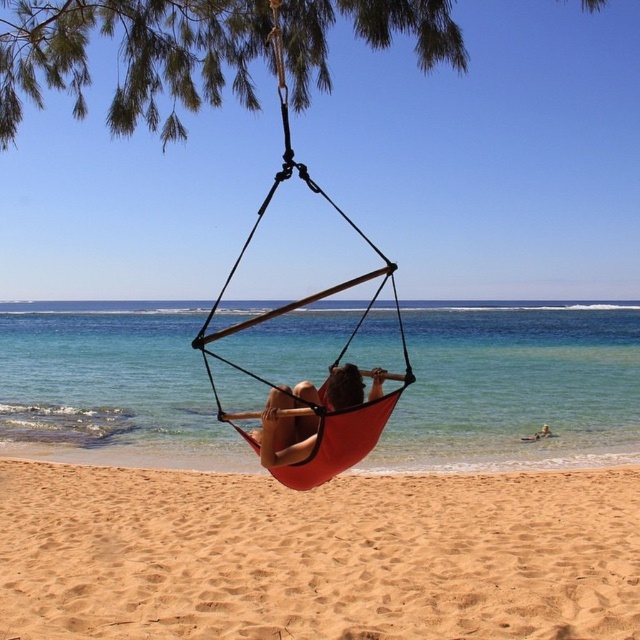
Is green leafy tree at upper center to the left of orange fabric hammock at center from the viewer's perspective?

Yes, green leafy tree at upper center is to the left of orange fabric hammock at center.

Who is more forward, (x=211, y=99) or (x=285, y=122)?

Point (x=285, y=122)

Where is `green leafy tree at upper center`? green leafy tree at upper center is located at coordinates (131, 58).

Does sandy yellow at lower center have a greater height compared to green leafy tree at upper center?

No, sandy yellow at lower center is not taller than green leafy tree at upper center.

From the picture: Who is lower down, sandy yellow at lower center or green leafy tree at upper center?

sandy yellow at lower center

The image size is (640, 640). Identify the location of sandy yellow at lower center. (317, 554).

Is sandy yellow at lower center smaller than matte orange hammock at center?

No, sandy yellow at lower center is not smaller than matte orange hammock at center.

Who is positioned more to the left, sandy yellow at lower center or matte orange hammock at center?

From the viewer's perspective, sandy yellow at lower center appears more on the left side.

The height and width of the screenshot is (640, 640). In order to click on sandy yellow at lower center in this screenshot , I will do `click(317, 554)`.